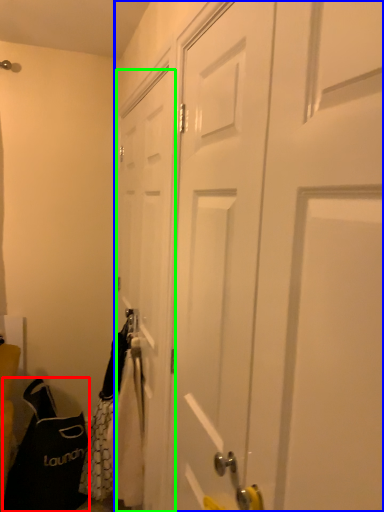
Question: Considering the real-world distances, which object is farthest from shoulder bag (highlighted by a red box)? door (highlighted by a blue box) or door (highlighted by a green box)?

Choices:
 (A) door
 (B) door

Answer: (A)